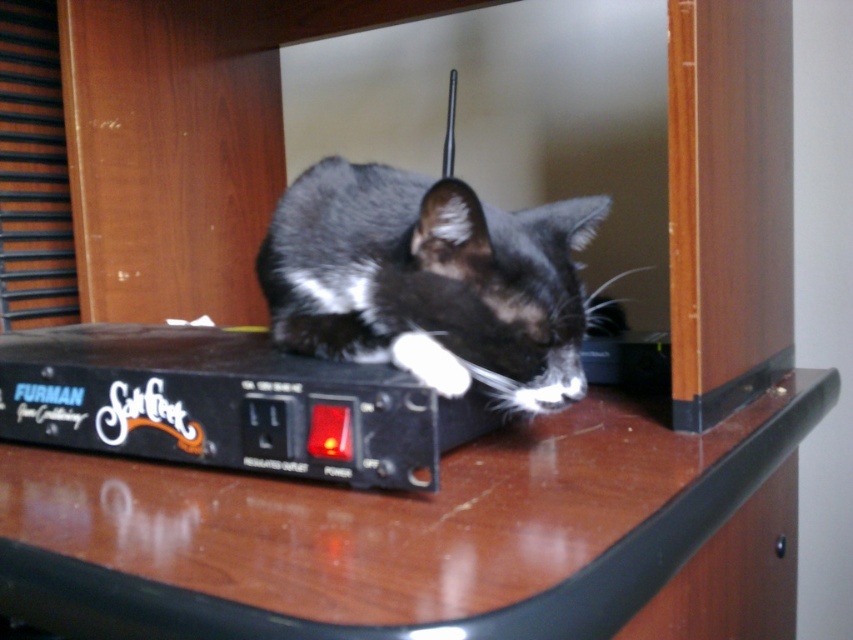
Measure the distance between brown glossy table at center and white fluffy paw at center.

brown glossy table at center is 18.87 centimeters away from white fluffy paw at center.

Between brown glossy table at center and white fluffy paw at center, which one appears on the right side from the viewer's perspective?

brown glossy table at center

The width and height of the screenshot is (853, 640). What do you see at coordinates (392, 532) in the screenshot? I see `brown glossy table at center` at bounding box center [392, 532].

Where is `brown glossy table at center`? brown glossy table at center is located at coordinates click(392, 532).

Is black fur cat at center positioned behind white fluffy paw at center?

No.

Is point (357, 173) positioned before point (460, 388)?

No, (357, 173) is behind (460, 388).

At what (x,y) coordinates should I click in order to perform the action: click on black fur cat at center. Please return your answer as a coordinate pair (x, y). The width and height of the screenshot is (853, 640). Looking at the image, I should click on (430, 280).

Who is positioned more to the right, brown glossy table at center or black fur cat at center?

brown glossy table at center is more to the right.

From the picture: Who is shorter, brown glossy table at center or black fur cat at center?

With less height is brown glossy table at center.

Is point (138, 589) positioned behind point (553, 269)?

No, it is not.

Where is `brown glossy table at center`? The width and height of the screenshot is (853, 640). brown glossy table at center is located at coordinates (392, 532).